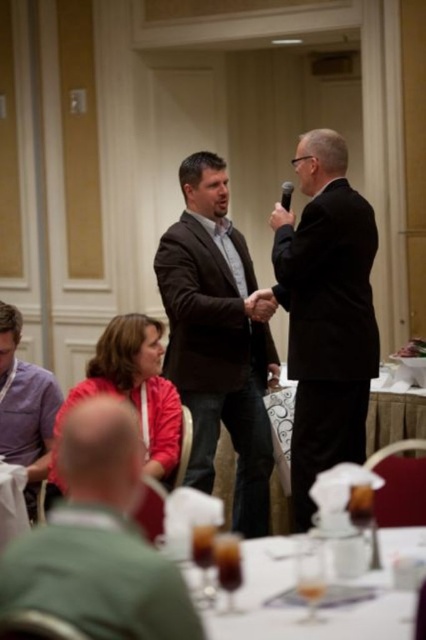
You are a guest at the event and want to grab your drink without disturbing the purple cotton shirt at lower left. Can you reach the clear glassware at lower center easily?

The clear glassware at lower center is in front of the purple cotton shirt at lower left, so you can easily reach it without disturbing the shirt.

You are a server at the event and need to deliver a drink to the guest wearing the purple cotton shirt at lower left. You are currently standing next to the clear glassware at lower center. Can you reach the guest without moving more than 1.8 meters?

The distance between the clear glassware at lower center and the purple cotton shirt at lower left is 2.00 meters, so you would need to move 2.00 meters to reach the guest, which is more than the 1.8 meters limit. Therefore, you cannot reach them without moving further.